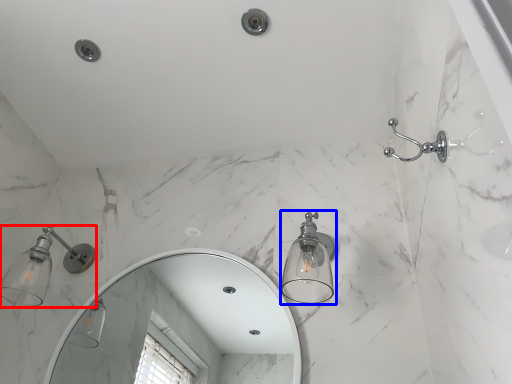
Question: Which of the following is the farthest to the observer, light fixture (highlighted by a red box) or light fixture (highlighted by a blue box)?

Choices:
 (A) light fixture
 (B) light fixture

Answer: (A)